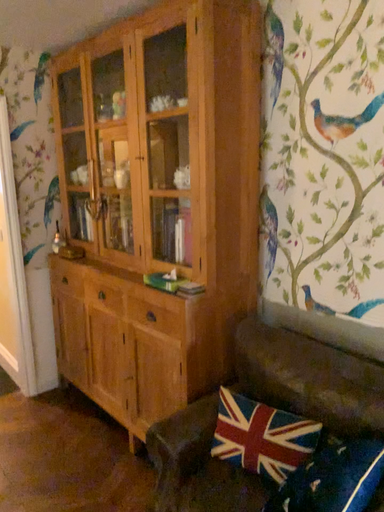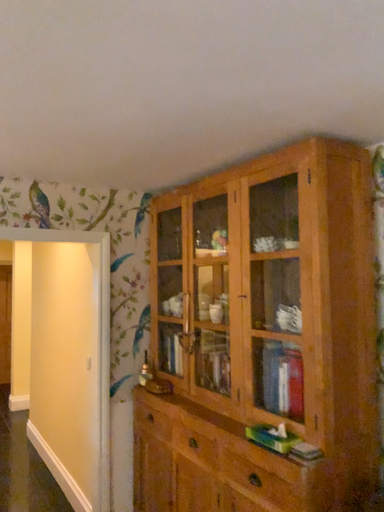
Question: How did the camera likely rotate when shooting the video?

Choices:
 (A) rotated downward
 (B) rotated upward

Answer: (B)